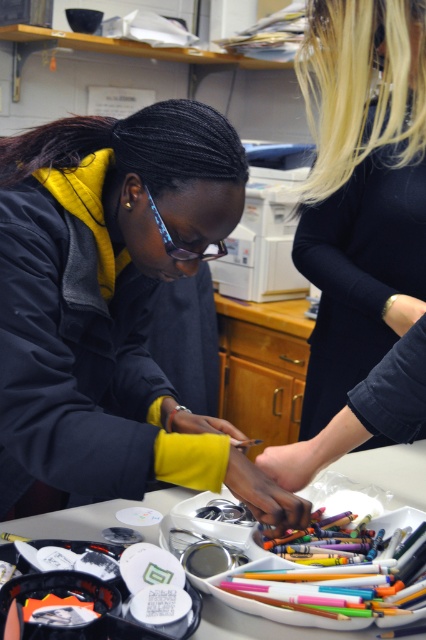
Image resolution: width=426 pixels, height=640 pixels. Describe the element at coordinates (362, 189) in the screenshot. I see `black matte shirt at upper right` at that location.

You are a GUI agent. You are given a task and a screenshot of the screen. Output one action in this format:
    pyautogui.click(x=<x>, y=<y>)
    Task: Click on the black matte shirt at upper right
    The height and width of the screenshot is (640, 426).
    Given the screenshot: What is the action you would take?
    pyautogui.click(x=362, y=189)